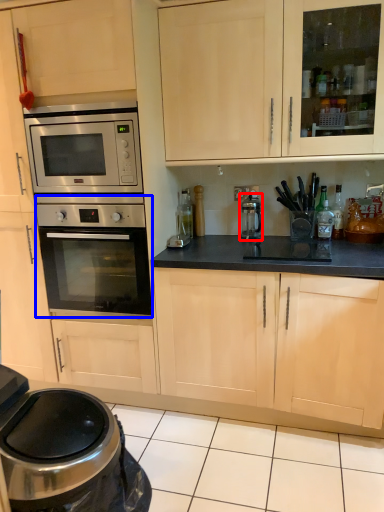
Question: Among these objects, which one is nearest to the camera, appliance (highlighted by a red box) or oven (highlighted by a blue box)?

Choices:
 (A) appliance
 (B) oven

Answer: (B)